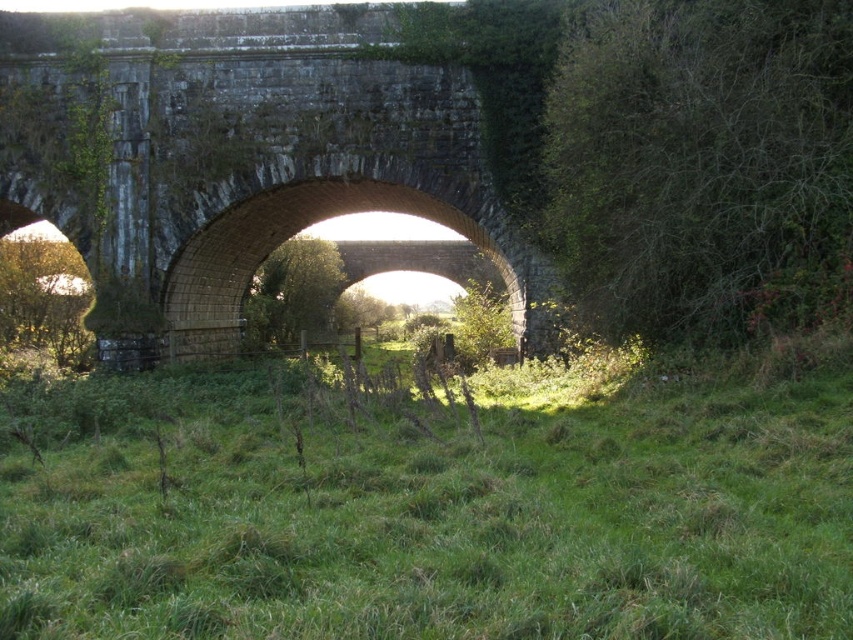
Question: Which point is closer to the camera taking this photo?

Choices:
 (A) (119, 138)
 (B) (773, 504)

Answer: (B)

Question: Can you confirm if green grassy field at center is bigger than dark gray stone bridge at center?

Choices:
 (A) no
 (B) yes

Answer: (A)

Question: Can you confirm if green grassy field at center is positioned below dark gray stone bridge at center?

Choices:
 (A) yes
 (B) no

Answer: (A)

Question: Is green grassy field at center positioned before dark gray stone bridge at center?

Choices:
 (A) no
 (B) yes

Answer: (B)

Question: Which point appears farthest from the camera in this image?

Choices:
 (A) (222, 374)
 (B) (424, 113)

Answer: (A)